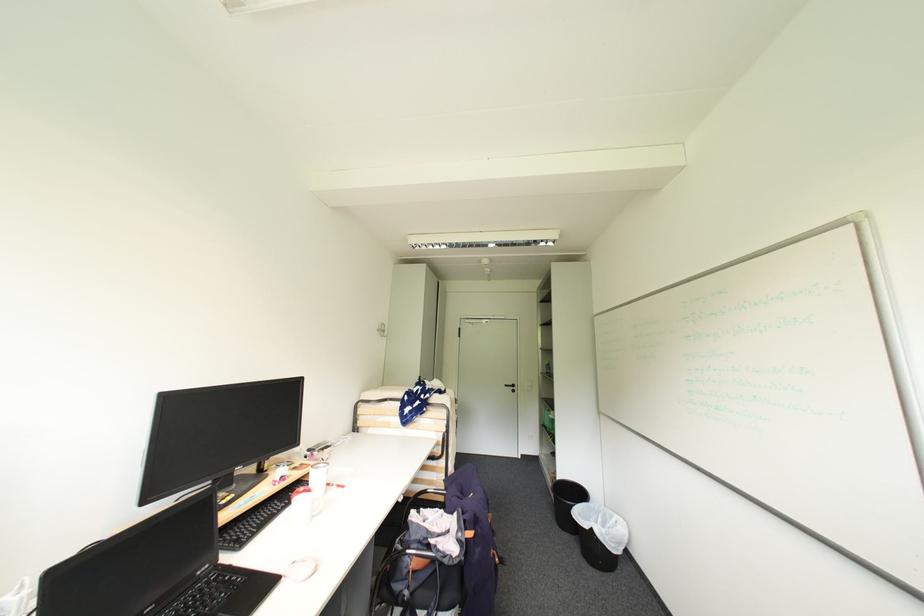
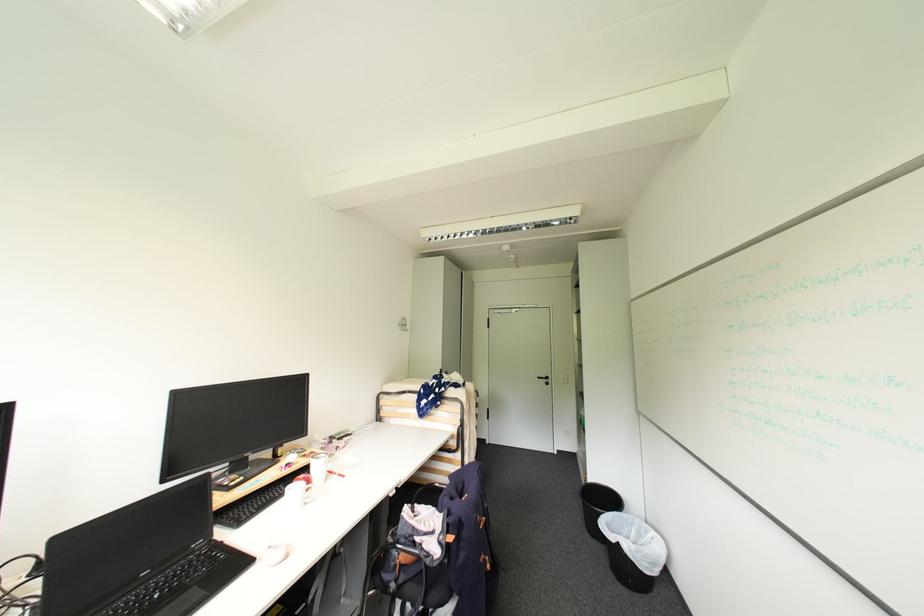
Where in the second image is the point corresponding to the point at 591,505 from the first image?

(624, 514)